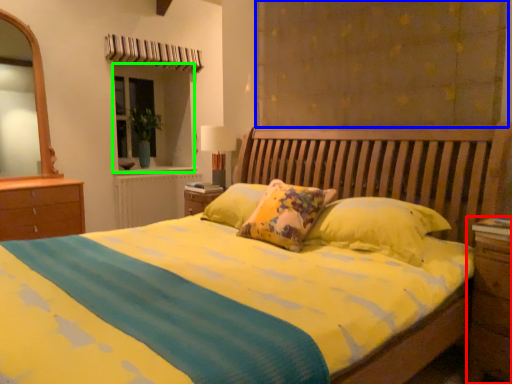
Question: Based on their relative distances, which object is nearer to nightstand (highlighted by a red box)? Choose from curtain (highlighted by a blue box) and window (highlighted by a green box).

Choices:
 (A) curtain
 (B) window

Answer: (A)